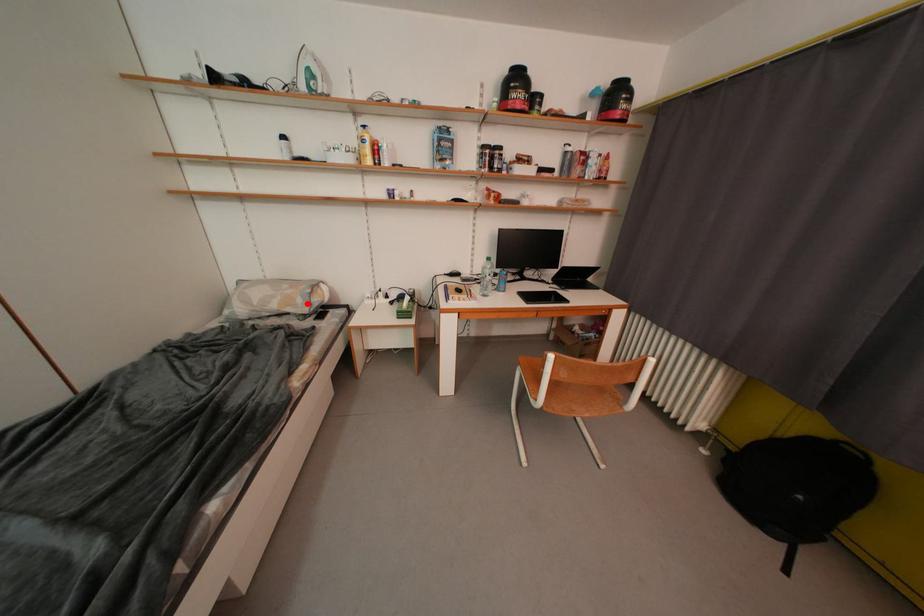
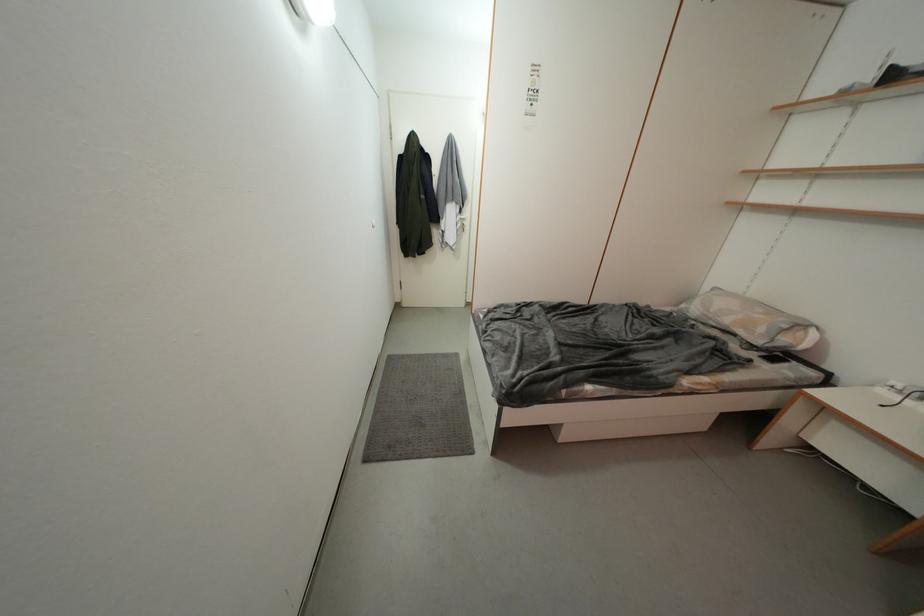
Question: I am providing you with two images of the same scene from different viewpoints. A red point is marked on the first image. At the location where the point appears in image 1, is it still visible in image 2?

Choices:
 (A) Yes
 (B) No

Answer: (A)